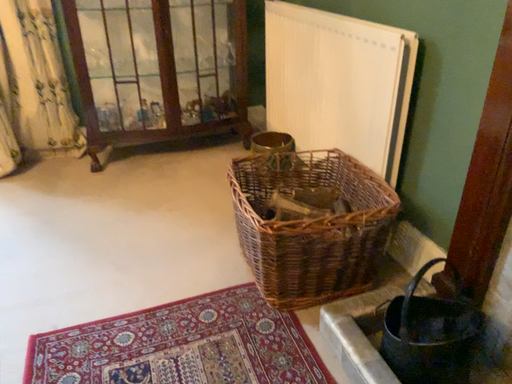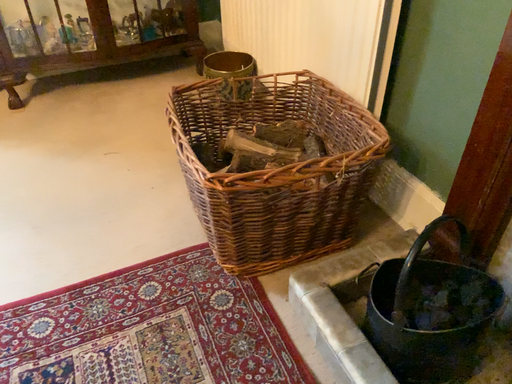
Question: How did the camera likely rotate when shooting the video?

Choices:
 (A) rotated upward
 (B) rotated downward

Answer: (B)